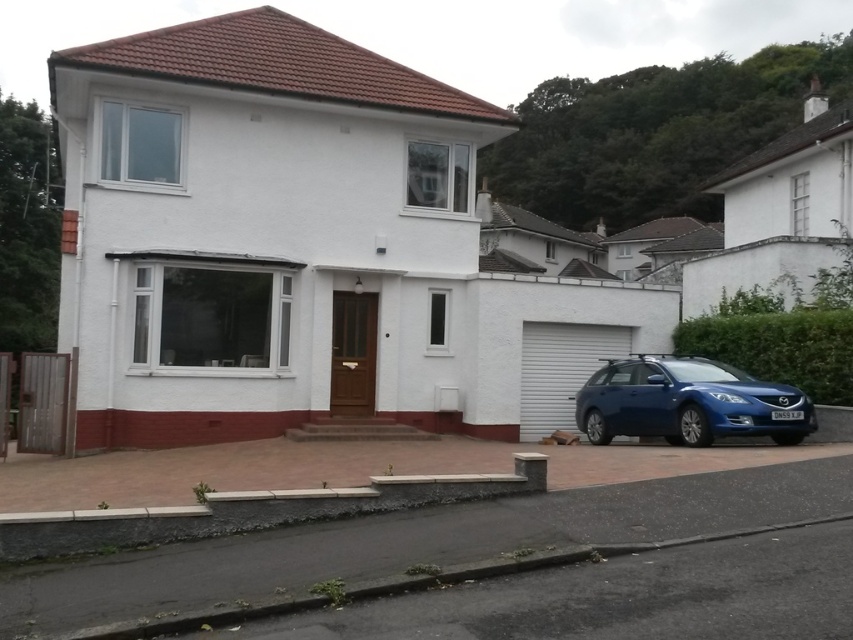
You are a delivery person approaching the house. You see the brick paved driveway at lower center and the paved concrete driveway at center. Which driveway should you drive onto first?

The brick paved driveway at lower center is above the paved concrete driveway at center, so you should drive onto the paved concrete driveway at center first before reaching the brick paved driveway at lower center.

You are standing at the front door of the house and want to park your car. The paved concrete driveway at center is represented by point [347,467]. Is the driveway directly in front of the house or to the side?

The paved concrete driveway at center is located at point [347,467], which is directly in front of the house.